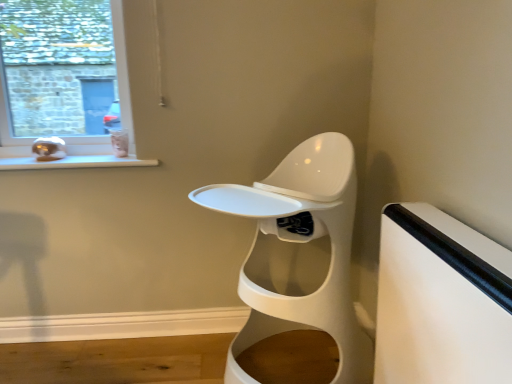
Question: Is white glossy toilet at center inside white matte table at right?

Choices:
 (A) yes
 (B) no

Answer: (B)

Question: From the image's perspective, is white matte table at right located beneath white glossy toilet at center?

Choices:
 (A) yes
 (B) no

Answer: (A)

Question: Is white matte table at right not within white glossy toilet at center?

Choices:
 (A) no
 (B) yes

Answer: (B)

Question: Can you confirm if white matte table at right is taller than white glossy toilet at center?

Choices:
 (A) no
 (B) yes

Answer: (A)

Question: From a real-world perspective, is white matte table at right on white glossy toilet at center?

Choices:
 (A) yes
 (B) no

Answer: (B)

Question: Is matte glass window at upper left in front of or behind white matte table at right in the image?

Choices:
 (A) front
 (B) behind

Answer: (B)

Question: Would you say matte glass window at upper left is inside or outside white matte table at right?

Choices:
 (A) outside
 (B) inside

Answer: (A)

Question: From a real-world perspective, is matte glass window at upper left above or below white matte table at right?

Choices:
 (A) above
 (B) below

Answer: (A)

Question: From the image's perspective, is matte glass window at upper left located above or below white matte table at right?

Choices:
 (A) below
 (B) above

Answer: (B)

Question: From the image's perspective, is white matte table at right located above or below white glossy toilet at center?

Choices:
 (A) above
 (B) below

Answer: (B)

Question: Considering the positions of white matte table at right and white glossy toilet at center in the image, is white matte table at right wider or thinner than white glossy toilet at center?

Choices:
 (A) wide
 (B) thin

Answer: (B)

Question: From a real-world perspective, is white matte table at right physically located above or below white glossy toilet at center?

Choices:
 (A) below
 (B) above

Answer: (A)

Question: Relative to white glossy toilet at center, is white matte table at right in front or behind?

Choices:
 (A) behind
 (B) front

Answer: (B)

Question: From the image's perspective, is white glossy toilet at center positioned above or below white glossy window sill at lower left?

Choices:
 (A) below
 (B) above

Answer: (A)

Question: From a real-world perspective, is white glossy toilet at center physically located above or below white glossy window sill at lower left?

Choices:
 (A) above
 (B) below

Answer: (B)